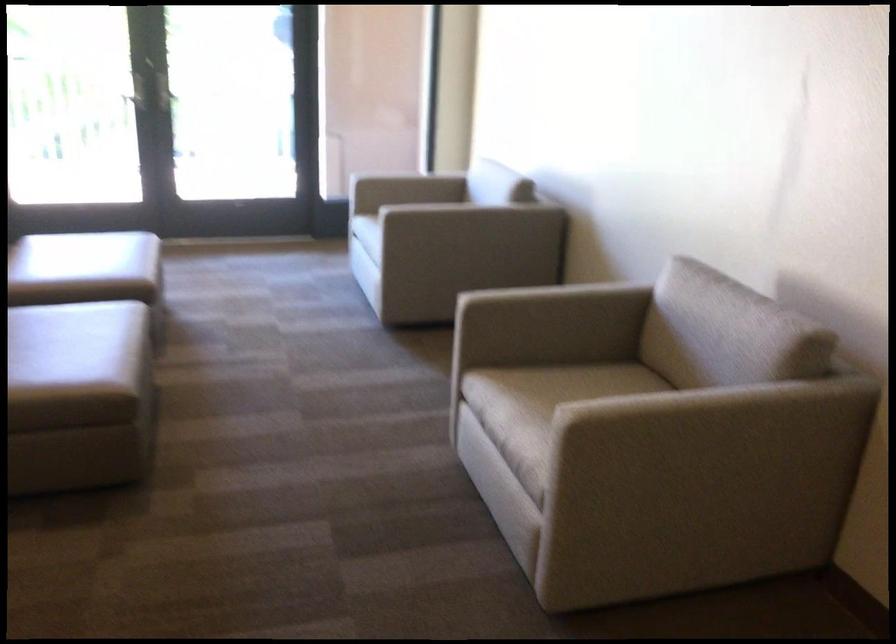
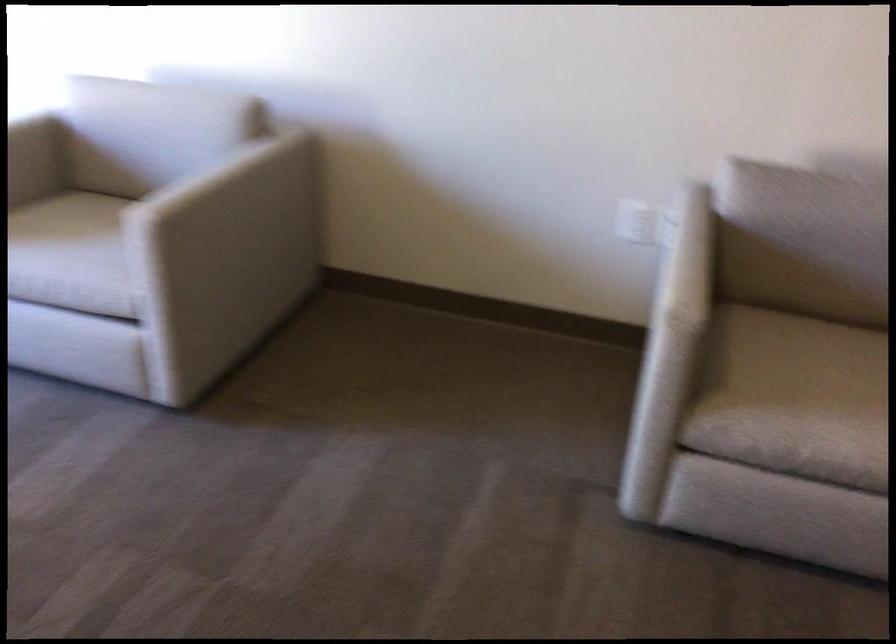
In the second image, find the point that corresponds to (433,174) in the first image.

(28, 124)